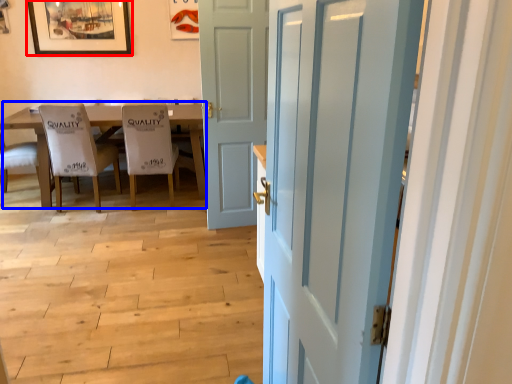
Question: Which object is further to the camera taking this photo, picture frame (highlighted by a red box) or kitchen & dining room table (highlighted by a blue box)?

Choices:
 (A) picture frame
 (B) kitchen & dining room table

Answer: (A)